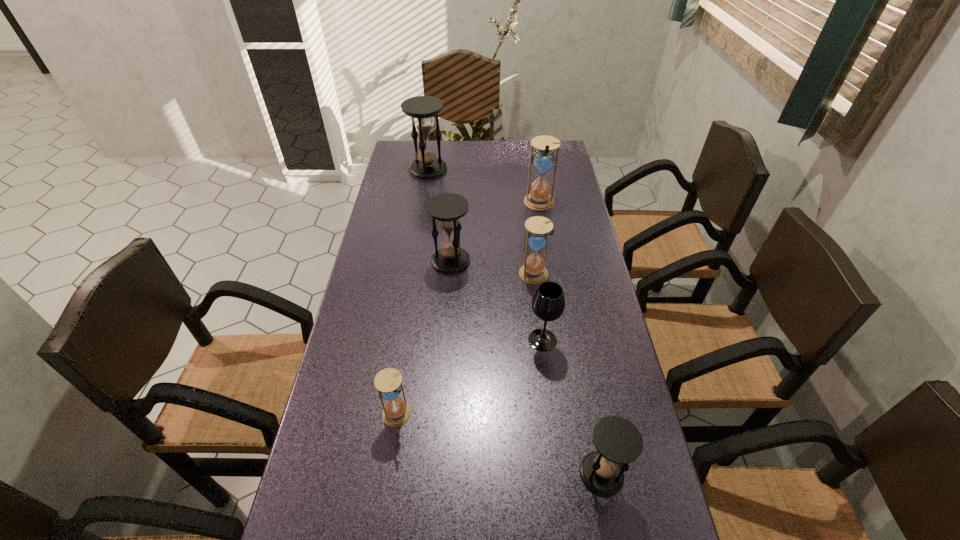
Locate an element on the screen. vacant space that satisfies the following two spatial constraints: 1. on the back side of the second smallest black hourglass; 2. on the right side of the leftmost white hourglass is located at coordinates (419, 261).

Where is `vacant space that satisfies the following two spatial constraints: 1. on the front side of the nearest hourglass; 2. on the right side of the second nearest black hourglass`? vacant space that satisfies the following two spatial constraints: 1. on the front side of the nearest hourglass; 2. on the right side of the second nearest black hourglass is located at coordinates (436, 474).

Find the location of a particular element. This screenshot has width=960, height=540. free space in the image that satisfies the following two spatial constraints: 1. on the front side of the smallest black hourglass; 2. on the right side of the biggest black hourglass is located at coordinates click(381, 474).